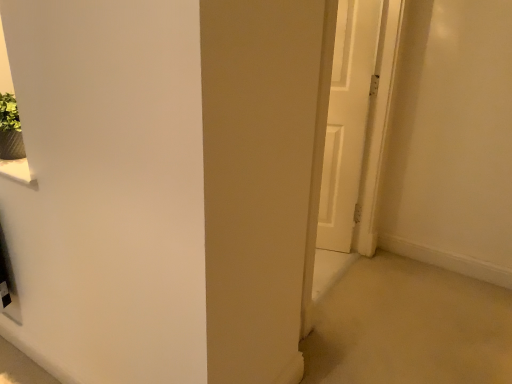
I want to click on white matte door at center, so click(x=347, y=120).

This screenshot has height=384, width=512. Describe the element at coordinates (347, 120) in the screenshot. I see `white matte door at center` at that location.

Identify the location of white matte door at center. The height and width of the screenshot is (384, 512). (347, 120).